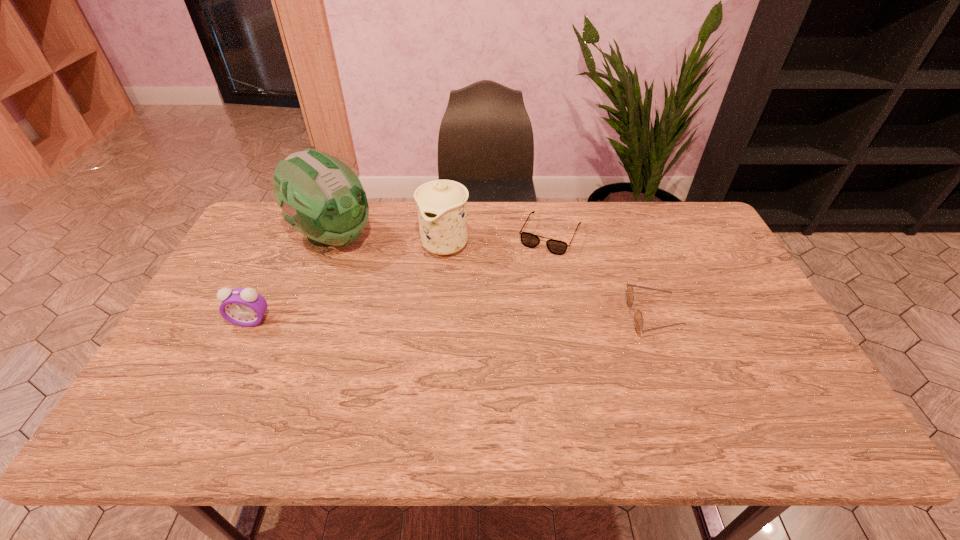
The width and height of the screenshot is (960, 540). What are the coordinates of `free area in between the chinaware and the alarm clock` in the screenshot? It's located at (348, 282).

At what (x,y) coordinates should I click in order to perform the action: click on blank region between the nearer spectacles and the second object from right to left. Please return your answer as a coordinate pair (x, y). Looking at the image, I should click on (601, 275).

The width and height of the screenshot is (960, 540). I want to click on vacant region between the nearer spectacles and the farther spectacles, so click(601, 275).

The width and height of the screenshot is (960, 540). What are the coordinates of `unoccupied area between the fourth shortest object and the football helmet` in the screenshot? It's located at (389, 240).

At what (x,y) coordinates should I click in order to perform the action: click on free spot between the right spectacles and the third object from left to right. Please return your answer as a coordinate pair (x, y). This screenshot has width=960, height=540. Looking at the image, I should click on (548, 280).

At what (x,y) coordinates should I click in order to perform the action: click on vacant area between the third tallest object and the rightmost object. Please return your answer as a coordinate pair (x, y). Looking at the image, I should click on (451, 319).

This screenshot has height=540, width=960. I want to click on free space between the left spectacles and the third object from left to right, so click(x=497, y=239).

Identify the location of vacant space that is in between the fourth object from left to right and the rightmost object. (601, 275).

Find the location of a particular element. The width and height of the screenshot is (960, 540). blank region between the tallest object and the third tallest object is located at coordinates (292, 279).

Identify the location of the closest object to the third tallest object. (321, 197).